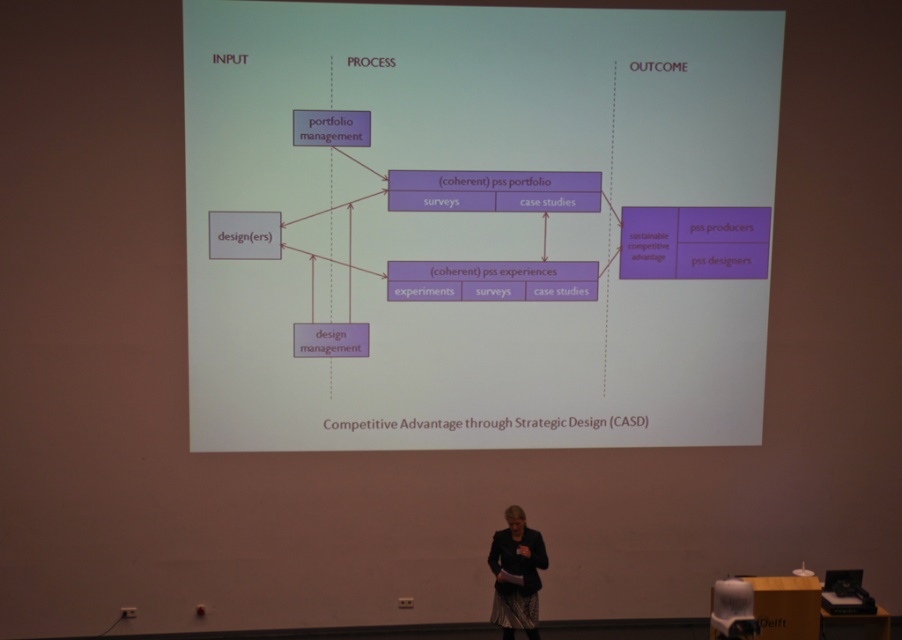
What is the 2D coordinate of the purple matte diagram at center?

The purple matte diagram at center is located at point (x=476, y=225).

Which object is positioned higher on the slide between the purple matte diagram at center and the dark gray fabric jacket at lower center?

The purple matte diagram at center is positioned higher than the dark gray fabric jacket at lower center.

You are an attendee at the seminar and want to compare the visual elements on the slide. Which of the two items, the purple matte diagram at center or the dark gray fabric jacket at lower center, takes up more horizontal space?

The purple matte diagram at center is wider than the dark gray fabric jacket at lower center.